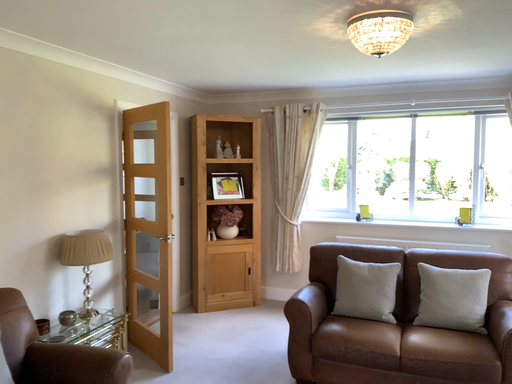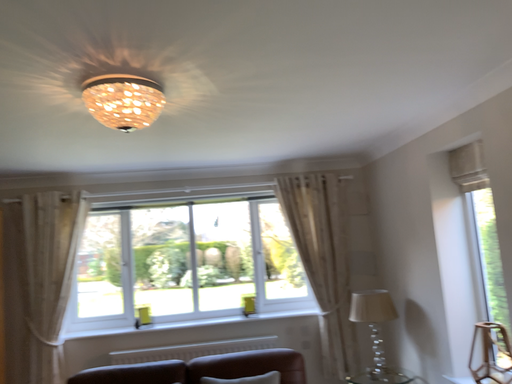
Question: How did the camera likely rotate when shooting the video?

Choices:
 (A) rotated upward
 (B) rotated downward

Answer: (A)